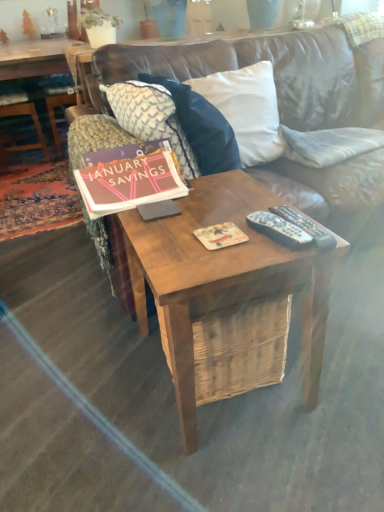
Image resolution: width=384 pixels, height=512 pixels. I want to click on vacant space behind matte cardboard magazine at center, so click(x=227, y=200).